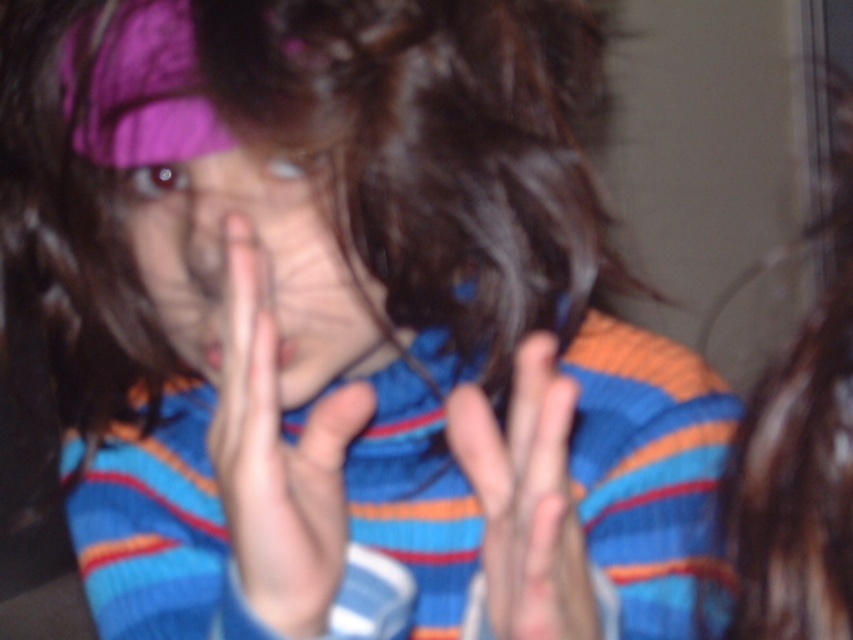
Question: Which of the following is the farthest from the observer?

Choices:
 (A) matte purple headband at center
 (B) brown shiny hair at right
 (C) smooth skin hand at center

Answer: (B)

Question: Is brown shiny hair at right below smooth skin hand at center?

Choices:
 (A) yes
 (B) no

Answer: (B)

Question: Is matte purple headband at center to the right of brown shiny hair at right from the viewer's perspective?

Choices:
 (A) no
 (B) yes

Answer: (A)

Question: Which object is the farthest from the brown shiny hair at right?

Choices:
 (A) matte purple headband at center
 (B) smooth skin hands at center

Answer: (B)

Question: Does brown shiny hair at right appear over smooth skin hand at center?

Choices:
 (A) no
 (B) yes

Answer: (B)

Question: Which object is farther from the camera taking this photo?

Choices:
 (A) smooth skin hands at center
 (B) smooth skin hand at center
 (C) brown shiny hair at right
 (D) matte purple headband at center

Answer: (C)